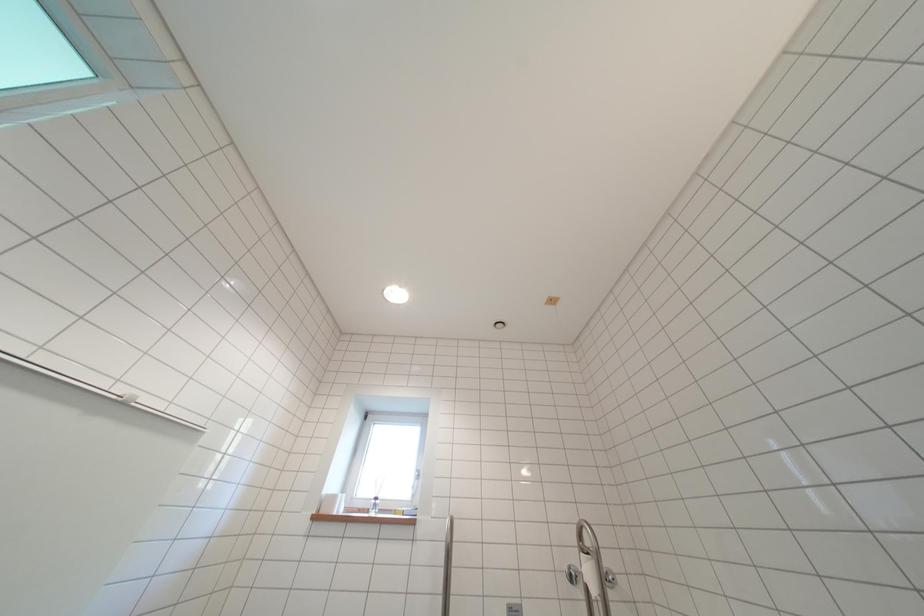
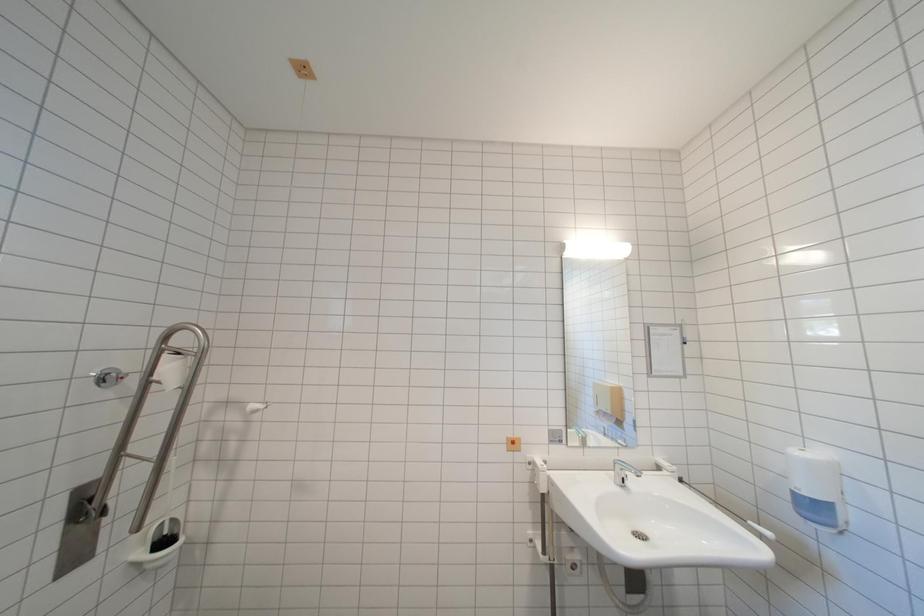
Question: Based on the continuous images, in which direction is the camera rotating? Reply with the corresponding letter.

Choices:
 (A) Left
 (B) Right
 (C) Up
 (D) Down

Answer: (B)